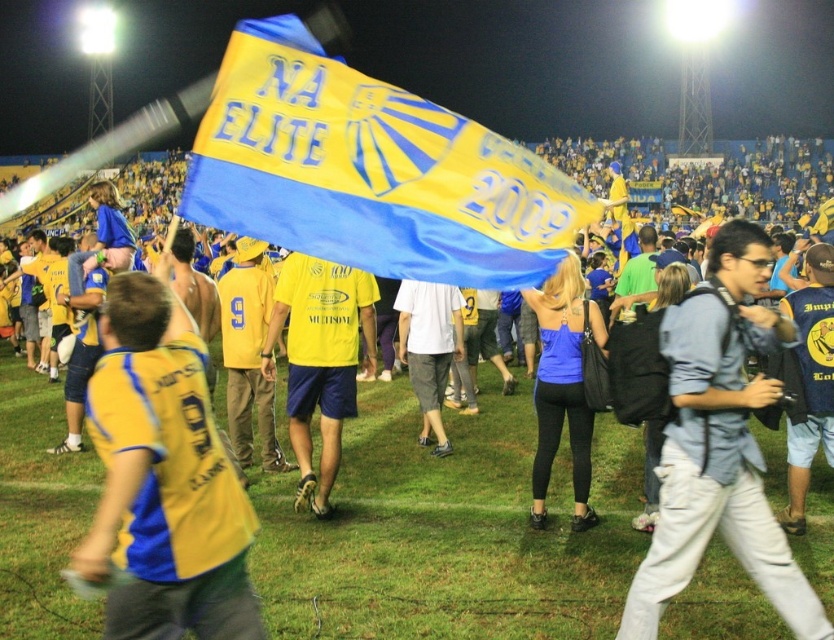
Based on the photo, can you confirm if yellow fabric flag at center is positioned below yellow matte shirt at center?

Incorrect, yellow fabric flag at center is not positioned below yellow matte shirt at center.

Which is behind, point (322, 104) or point (265, 358)?

The point (265, 358) is more distant.

Is point (471, 180) positioned after point (348, 276)?

No, it is in front of (348, 276).

This screenshot has width=834, height=640. What are the coordinates of `yellow fabric flag at center` in the screenshot? It's located at (370, 172).

Is yellow fabric flag at center smaller than light blue denim shirt at center?

No, yellow fabric flag at center is not smaller than light blue denim shirt at center.

Is the position of yellow fabric flag at center more distant than that of light blue denim shirt at center?

No, yellow fabric flag at center is in front of light blue denim shirt at center.

You are a GUI agent. You are given a task and a screenshot of the screen. Output one action in this format:
    pyautogui.click(x=<x>, y=<y>)
    Task: Click on the yellow fabric flag at center
    Image resolution: width=834 pixels, height=640 pixels.
    Given the screenshot: What is the action you would take?
    coord(370,172)

I want to click on yellow fabric flag at center, so click(370, 172).

Is yellow jersey at center positioned in front of yellow matte shirt at center?

Yes, it is.

Who is more forward, (108, 332) or (347, 282)?

Point (108, 332) is in front.

Find the location of a particular element. The width and height of the screenshot is (834, 640). yellow jersey at center is located at coordinates (163, 480).